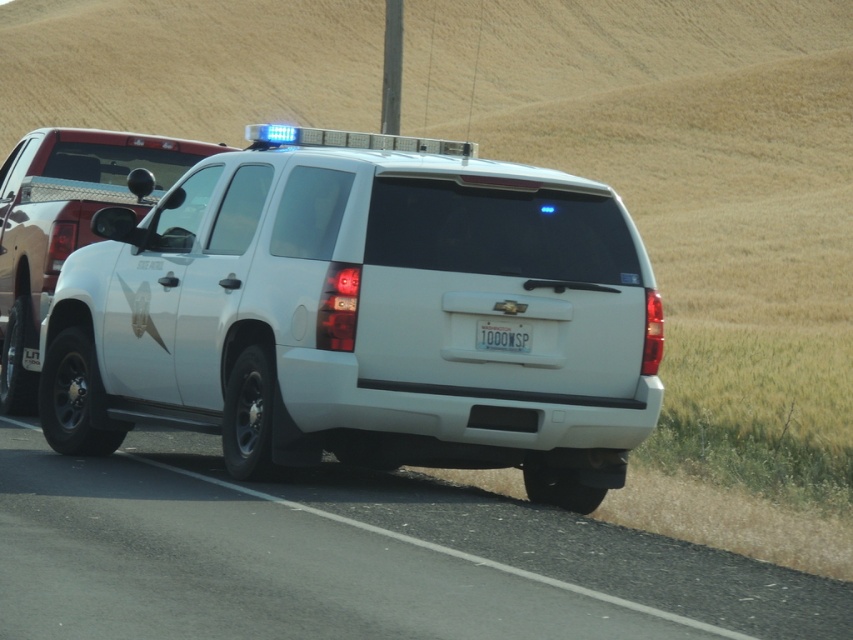
From the picture: You are standing in front of the white Chevrolet Tahoe police vehicle and want to place a small marker at two specific points. The first point is at coordinates point [456,220] and the second point is at point [32,348]. Which point is closer to you?

Point [456,220] is closer to the viewer than point [32,348].

You are a photographer trying to capture the white glossy suv at center and the white plastic license plate at center in a single frame. Given their sizes, which object will appear bigger in your photo?

The white glossy suv at center will appear bigger in the photo because it is larger in size than the white plastic license plate at center.

You are a driver approaching the white glossy suv at center and the white plastic license plate at center. Which object will you see first as you move closer?

The white glossy suv at center will be seen first because it is closer to you than the white plastic license plate at center, which is further away.